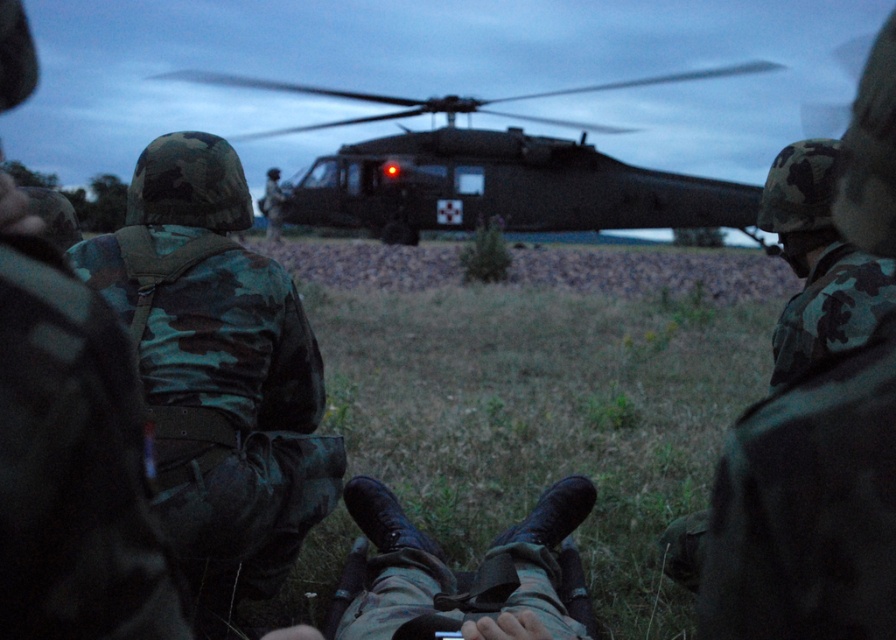
You are a soldier in the field and need to quickly move from the matte black gun at lower center to the dark matte helicopter at center for urgent medical assistance. Given that your maximum sprinting distance without rest is 15 meters, can you reach the helicopter without stopping?

The distance between the dark matte helicopter at center and the matte black gun at lower center is 17.75 meters. Since your maximum sprinting distance without rest is 15 meters, you cannot reach the helicopter without stopping as the distance exceeds your limit by 2.75 meters.

You are a drone operator trying to land a drone on the helicopter at center. The drone can only land on flat surfaces. Is the area around point (493, 172) on the helicopter at center suitable for landing?

The area around point (493, 172) on the helicopter at center is suitable for landing because it is a flat surface.